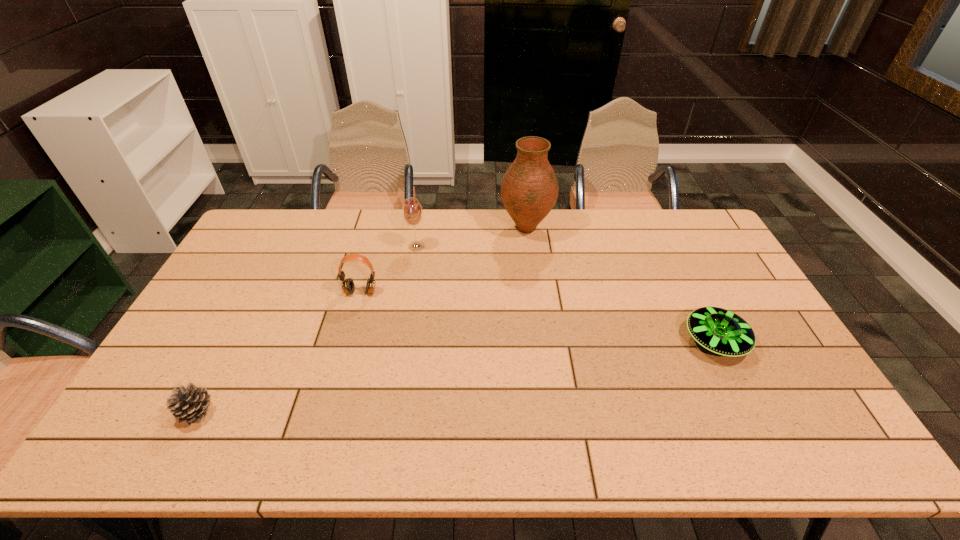
This screenshot has width=960, height=540. Find the location of `the tallest object`. the tallest object is located at coordinates (529, 190).

At what (x,y) coordinates should I click in order to perform the action: click on vase. Please return your answer as a coordinate pair (x, y). The height and width of the screenshot is (540, 960). Looking at the image, I should click on (529, 190).

Locate an element on the screen. Image resolution: width=960 pixels, height=540 pixels. the second tallest object is located at coordinates 412,212.

You are a GUI agent. You are given a task and a screenshot of the screen. Output one action in this format:
    pyautogui.click(x=<x>, y=<y>)
    Task: Click on the wineglass
    
    Given the screenshot: What is the action you would take?
    pyautogui.click(x=412, y=212)

Locate an element on the screen. This screenshot has height=540, width=960. the third shortest object is located at coordinates (348, 287).

Identify the location of the third farthest object. (348, 287).

Locate an element on the screen. This screenshot has width=960, height=540. the nearest object is located at coordinates (190, 404).

Locate an element on the screen. The width and height of the screenshot is (960, 540). pinecone is located at coordinates (190, 404).

This screenshot has height=540, width=960. Identify the location of the rightmost object. tap(718, 330).

This screenshot has height=540, width=960. I want to click on saucer, so click(718, 330).